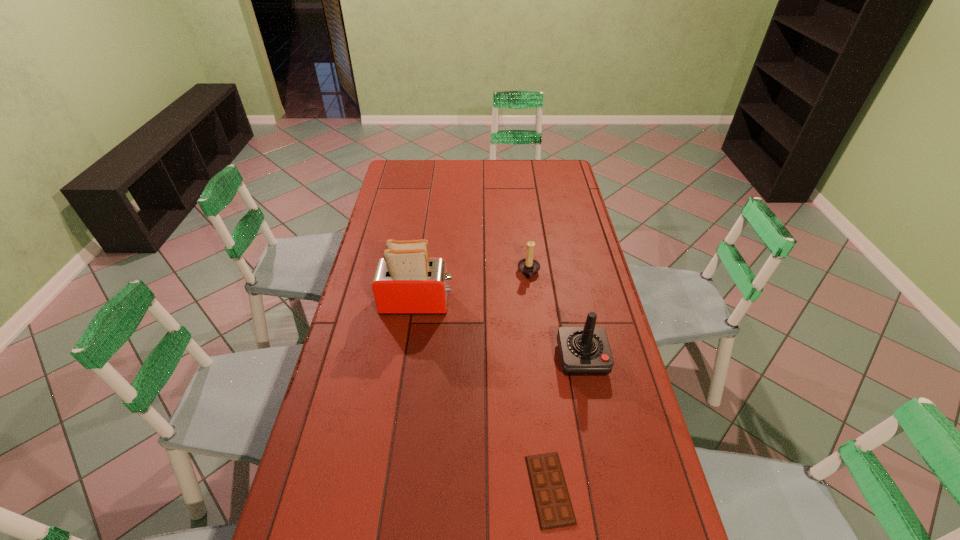
Find the location of a particular element. Image resolution: width=960 pixels, height=540 pixels. object that can be found as the second closest to the candle holder is located at coordinates (584, 351).

What are the coordinates of `vacant space that satisfies the following two spatial constraints: 1. on the front-facing side of the nearest object; 2. on the left side of the third nearest object` in the screenshot? It's located at (391, 489).

At what (x,y) coordinates should I click in order to perform the action: click on free space in the image that satisfies the following two spatial constraints: 1. on the wick of the candle holder; 2. on the front side of the shortest object. Please return your answer as a coordinate pair (x, y). Looking at the image, I should click on (555, 489).

Where is `vacant area in the image that satisfies the following two spatial constraints: 1. on the back side of the nearest object; 2. on the front-facing side of the toaster`? The height and width of the screenshot is (540, 960). vacant area in the image that satisfies the following two spatial constraints: 1. on the back side of the nearest object; 2. on the front-facing side of the toaster is located at coordinates (529, 303).

I want to click on free space that satisfies the following two spatial constraints: 1. on the front-facing side of the tallest object; 2. on the back side of the nearest object, so click(391, 489).